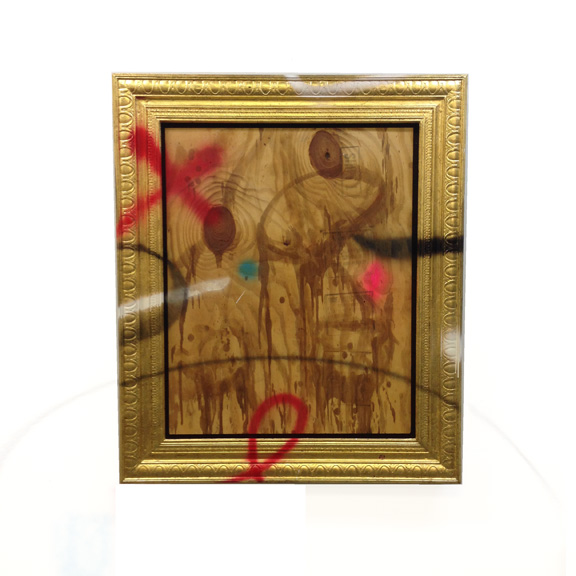
I want to click on inner corners of golden frame, so click(x=165, y=437), click(x=160, y=122), click(x=418, y=122), click(x=412, y=435).